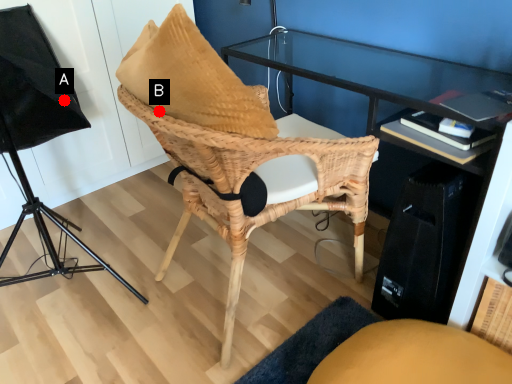
Question: Two points are circled on the image, labeled by A and B beside each circle. Which of the following is the closest to the observer?

Choices:
 (A) A is closer
 (B) B is closer

Answer: (B)